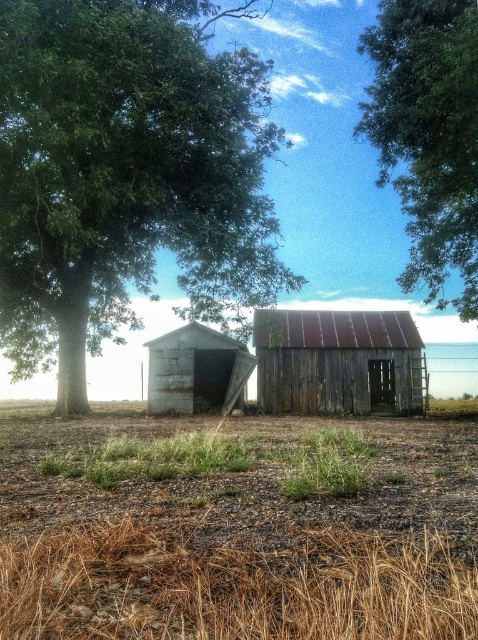
Looking at this image, you are a gardener who wants to plant a new tree in the brown soil at center. Considering the green leafy tree at upper center, where should you plant the new tree to ensure it gets enough sunlight?

The brown soil at center is below the green leafy tree at upper center, so planting the new tree there might not provide enough sunlight due to the existing tree casting shade. Choose a spot away from the green leafy tree at upper center to ensure adequate sunlight.

You are standing in the middle of the scene and want to walk towards the green leafy tree at upper center. Which direction should you look to see the brown soil at center first before moving towards the tree?

You should look downward because the brown soil at center is closer to you than the green leafy tree at upper center, so it will be visible below the tree when looking towards it.